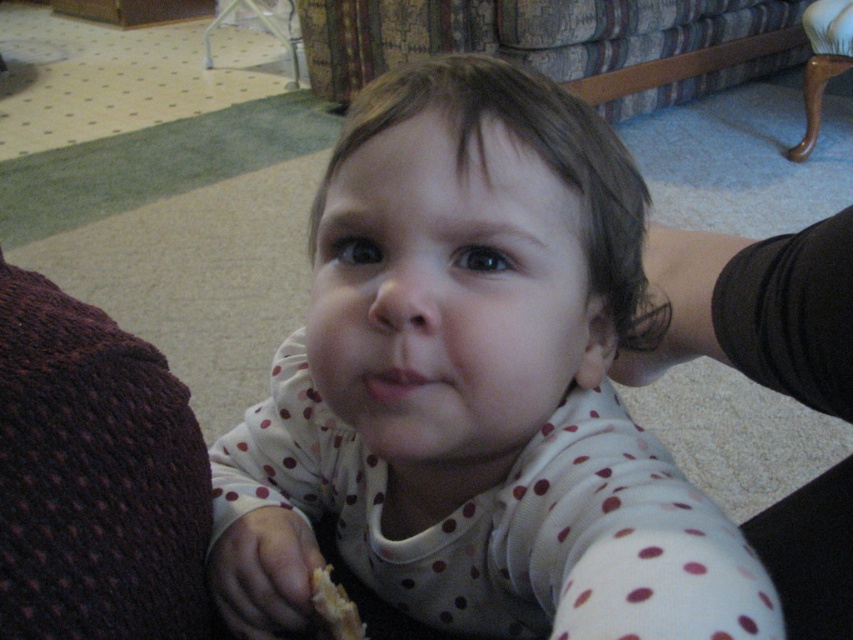
Question: Estimate the real-world distances between objects in this image. Which object is closer to the crumbly bread at lower left?

Choices:
 (A) dark purple knitted sweater at left
 (B) white polka dot onesie at center

Answer: (A)

Question: Is dark purple knitted sweater at left in front of crumbly bread at lower left?

Choices:
 (A) yes
 (B) no

Answer: (A)

Question: Which of the following is the farthest from the observer?

Choices:
 (A) crumbly bread at lower left
 (B) white polka dot onesie at center

Answer: (A)

Question: Which point is closer to the camera taking this photo?

Choices:
 (A) (355, 141)
 (B) (96, 381)

Answer: (A)

Question: From the image, what is the correct spatial relationship of dark purple knitted sweater at left in relation to crumbly bread at lower left?

Choices:
 (A) above
 (B) below

Answer: (A)

Question: Is white polka dot onesie at center above dark purple knitted sweater at left?

Choices:
 (A) yes
 (B) no

Answer: (B)